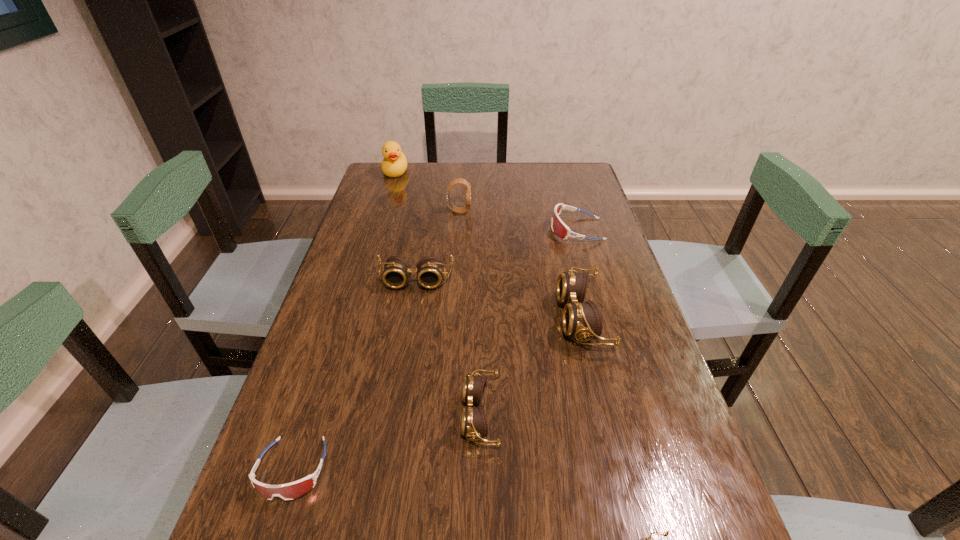
This screenshot has height=540, width=960. I want to click on duck, so click(x=394, y=164).

You are a GUI agent. You are given a task and a screenshot of the screen. Output one action in this format:
    pyautogui.click(x=<x>, y=<y>)
    Task: Click on the yellow duck
    
    Given the screenshot: What is the action you would take?
    pyautogui.click(x=394, y=164)

Find the location of a particular element. watch is located at coordinates (460, 210).

The image size is (960, 540). In order to click on the sixth shortest object in this screenshot , I will do `click(580, 320)`.

Find the location of a particular element. This screenshot has height=540, width=960. the tallest goggles is located at coordinates (580, 320).

Locate an element on the screen. The width and height of the screenshot is (960, 540). the second goggles from left to right is located at coordinates (x=430, y=269).

You are a GUI agent. You are given a task and a screenshot of the screen. Output one action in this format:
    pyautogui.click(x=<x>, y=<y>)
    Task: Click on the fourth tallest object
    
    Given the screenshot: What is the action you would take?
    pyautogui.click(x=430, y=269)

Where is `the farther red goggles`? The image size is (960, 540). the farther red goggles is located at coordinates (558, 226).

The width and height of the screenshot is (960, 540). I want to click on the bigger red goggles, so (x=558, y=226).

This screenshot has height=540, width=960. I want to click on the third brown goggles from right to left, so click(x=474, y=424).